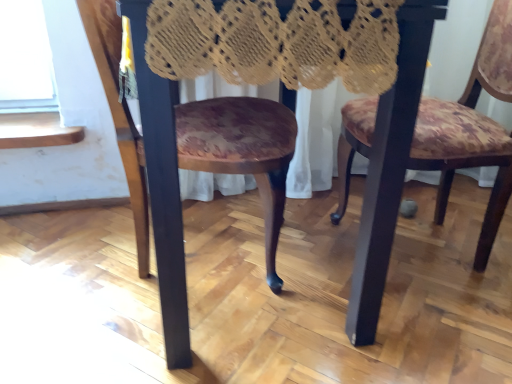
Image resolution: width=512 pixels, height=384 pixels. In order to click on vacant space situated on the left part of wooden floral-patterned chair at center, which is the second chair from right to left in this screenshot , I will do `click(67, 254)`.